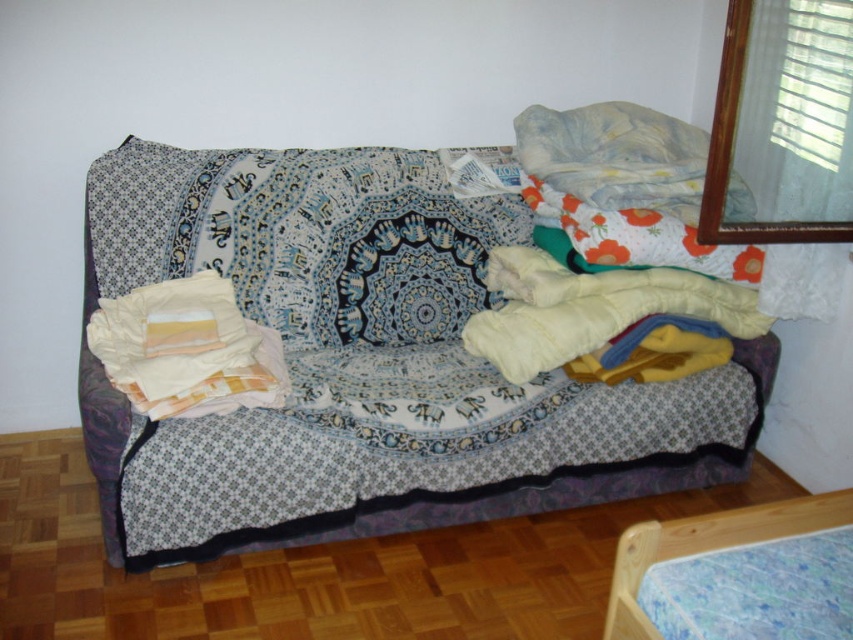
Is white soft pillow at center further to the viewer compared to blue floral mattress at lower right?

Yes, white soft pillow at center is further from the viewer.

The width and height of the screenshot is (853, 640). I want to click on white soft pillow at center, so click(x=187, y=349).

Is point (469, 230) farther from camera compared to point (241, 205)?

Yes, it is.

Between patterned fabric couch at center and fluffy white pillow at center, which one is positioned higher?

fluffy white pillow at center is above.

Locate an element on the screen. patterned fabric couch at center is located at coordinates (363, 364).

Locate an element on the screen. This screenshot has width=853, height=640. patterned fabric couch at center is located at coordinates (363, 364).

Based on the photo, who is taller, fluffy white pillow at center or blue floral mattress at lower right?

fluffy white pillow at center

Where is `fluffy white pillow at center`? The height and width of the screenshot is (640, 853). fluffy white pillow at center is located at coordinates pyautogui.click(x=303, y=236).

Does point (212, 168) come behind point (811, 618)?

Yes.

The width and height of the screenshot is (853, 640). Identify the location of fluffy white pillow at center. (303, 236).